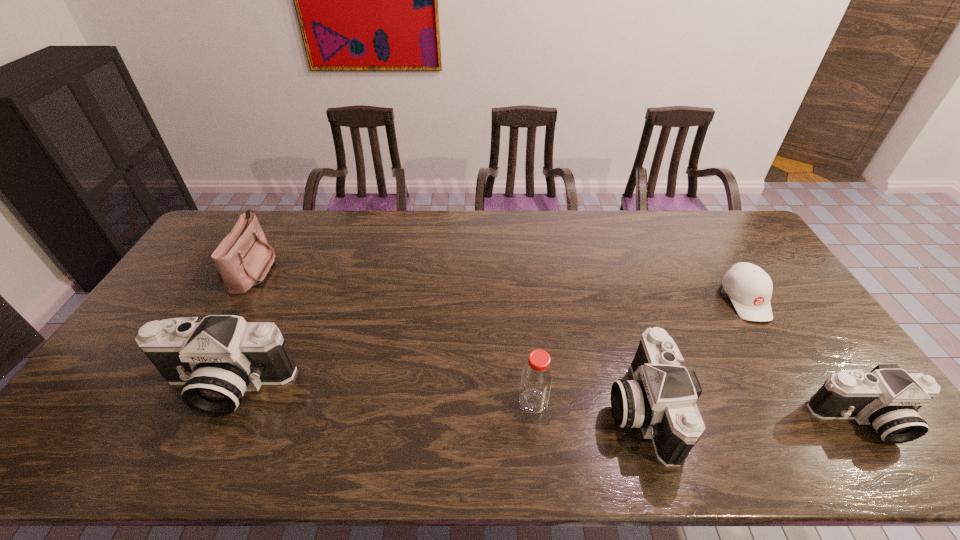
Locate an element on the screen. The height and width of the screenshot is (540, 960). the leftmost camera is located at coordinates (216, 360).

Where is `the second camera from left to right`? the second camera from left to right is located at coordinates (661, 400).

This screenshot has width=960, height=540. In order to click on the fourth object from left to right in this screenshot , I will do `click(661, 400)`.

Find the location of a particular element. the shortest camera is located at coordinates (888, 398).

You are a GUI agent. You are given a task and a screenshot of the screen. Output one action in this format:
    pyautogui.click(x=<x>, y=<y>)
    Task: Click on the shoulder bag
    
    Given the screenshot: What is the action you would take?
    pyautogui.click(x=243, y=259)

The width and height of the screenshot is (960, 540). I want to click on the shortest object, so click(749, 287).

Find the location of a particular element. bottle is located at coordinates (536, 379).

Identify the location of vacant space situated on the back of the leftmost camera. (259, 316).

Image resolution: width=960 pixels, height=540 pixels. In order to click on vacant space positioned 0.220m on the right of the second camera from left to right in this screenshot , I will do `click(761, 408)`.

The height and width of the screenshot is (540, 960). Find the location of `vacant space located on the left of the shortest camera`. vacant space located on the left of the shortest camera is located at coordinates (658, 420).